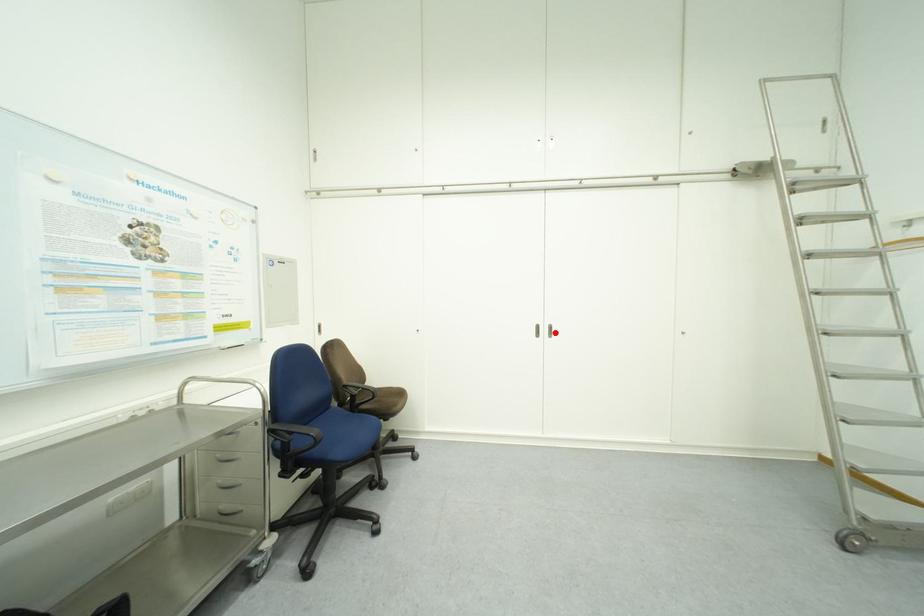
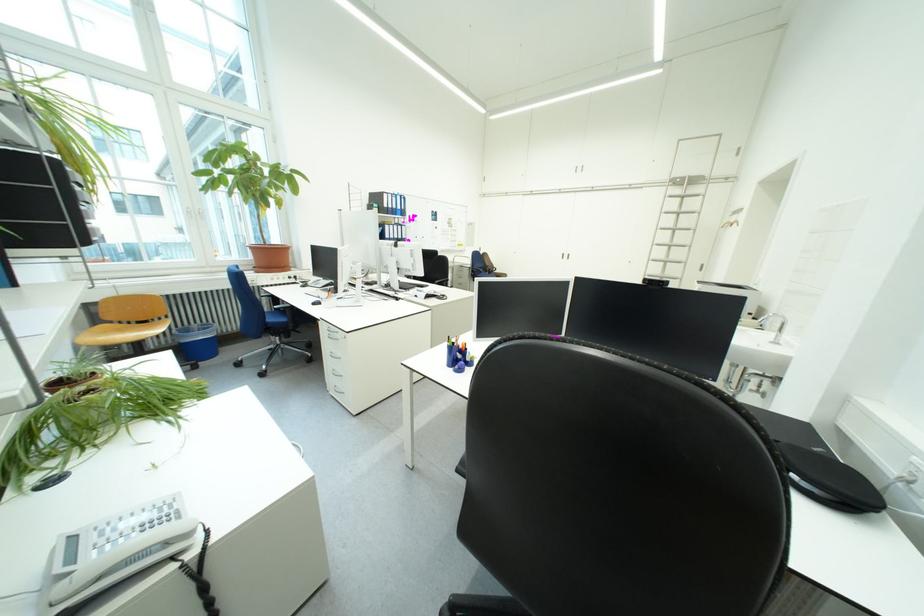
Where in the second image is the point corresponding to the highlighted location from the first image?

(577, 257)